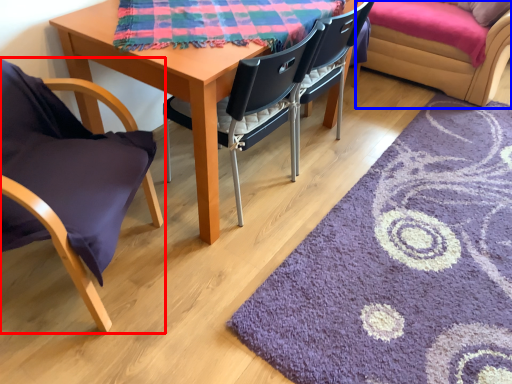
Question: Which object is further to the camera taking this photo, chair (highlighted by a red box) or couch (highlighted by a blue box)?

Choices:
 (A) chair
 (B) couch

Answer: (B)